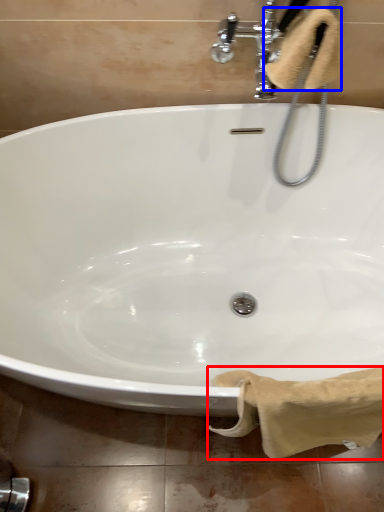
Question: Which object is closer to the camera taking this photo, bath towel (highlighted by a red box) or bath towel (highlighted by a blue box)?

Choices:
 (A) bath towel
 (B) bath towel

Answer: (A)